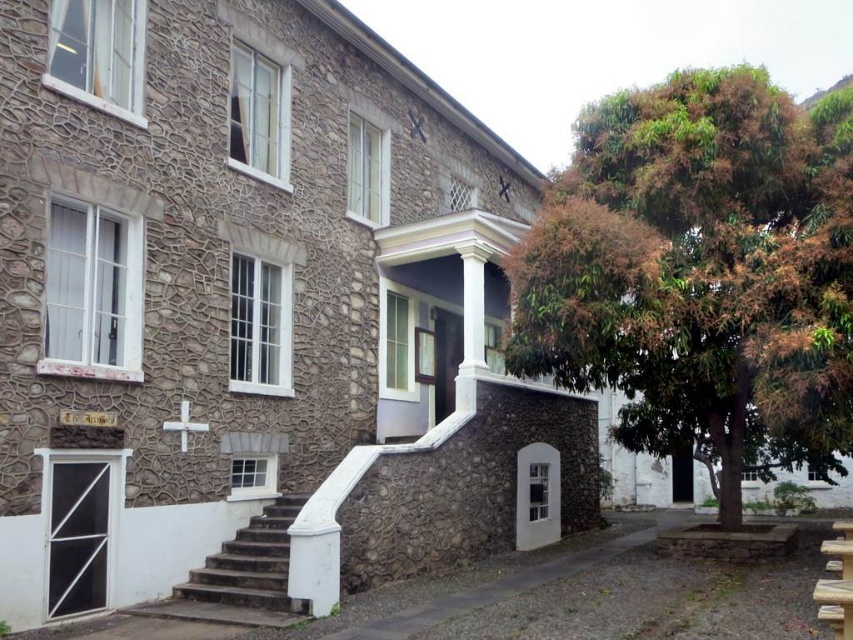
You are standing at the base of the white stone stairs at lower left and want to walk towards the brown leafy tree at right. Which direction should you move relative to the stairs?

Since the brown leafy tree at right is further to the viewer than the white stone stairs at lower left, you should move towards the tree by walking towards the direction where the tree is closer, which would be to your right side relative to the stairs.

You are standing at the entrance of the two story building and want to plant a new tree in the same location as the brown leafy tree at right. What are the coordinates where you should plant the new tree?

The coordinates for the brown leafy tree at right are at point (x=701, y=273), so you should plant the new tree at those coordinates.